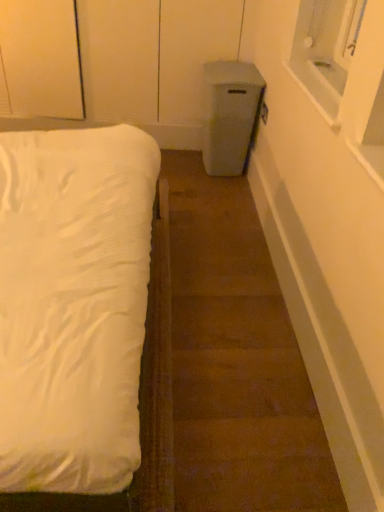
Question: Should I look upward or downward to see white soft bed at left?

Choices:
 (A) down
 (B) up

Answer: (B)

Question: From the image's perspective, is brown carpet at lower left below white soft bed at left?

Choices:
 (A) yes
 (B) no

Answer: (A)

Question: Considering the relative positions of brown carpet at lower left and white soft bed at left in the image provided, is brown carpet at lower left to the right of white soft bed at left from the viewer's perspective?

Choices:
 (A) no
 (B) yes

Answer: (B)

Question: Is brown carpet at lower left at the left side of white soft bed at left?

Choices:
 (A) no
 (B) yes

Answer: (A)

Question: From a real-world perspective, does brown carpet at lower left sit lower than white soft bed at left?

Choices:
 (A) no
 (B) yes

Answer: (B)

Question: Does brown carpet at lower left have a larger size compared to white soft bed at left?

Choices:
 (A) no
 (B) yes

Answer: (A)

Question: Is brown carpet at lower left positioned beyond the bounds of white soft bed at left?

Choices:
 (A) no
 (B) yes

Answer: (B)

Question: Considering the relative sizes of white soft bed at left and brown carpet at lower left in the image provided, is white soft bed at left wider than brown carpet at lower left?

Choices:
 (A) yes
 (B) no

Answer: (A)

Question: Is white soft bed at left thinner than brown carpet at lower left?

Choices:
 (A) yes
 (B) no

Answer: (B)

Question: Can you confirm if white soft bed at left is taller than brown carpet at lower left?

Choices:
 (A) yes
 (B) no

Answer: (A)

Question: Does white soft bed at left come behind brown carpet at lower left?

Choices:
 (A) no
 (B) yes

Answer: (A)

Question: From the image's perspective, is white soft bed at left located above brown carpet at lower left?

Choices:
 (A) yes
 (B) no

Answer: (A)

Question: Is white soft bed at left in contact with brown carpet at lower left?

Choices:
 (A) yes
 (B) no

Answer: (B)

Question: Considering the positions of brown carpet at lower left and white soft bed at left in the image, is brown carpet at lower left taller or shorter than white soft bed at left?

Choices:
 (A) short
 (B) tall

Answer: (A)